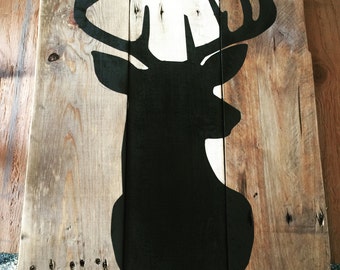
Locate an element on the screen. This screenshot has height=270, width=340. reflective light above head is located at coordinates (175, 42).